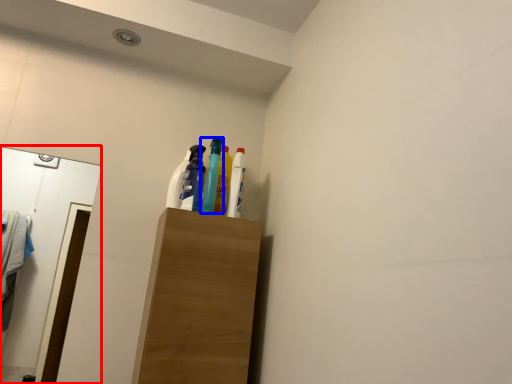
Question: Which object appears closest to the camera in this image, mirror (highlighted by a red box) or bottle (highlighted by a blue box)?

Choices:
 (A) mirror
 (B) bottle

Answer: (A)